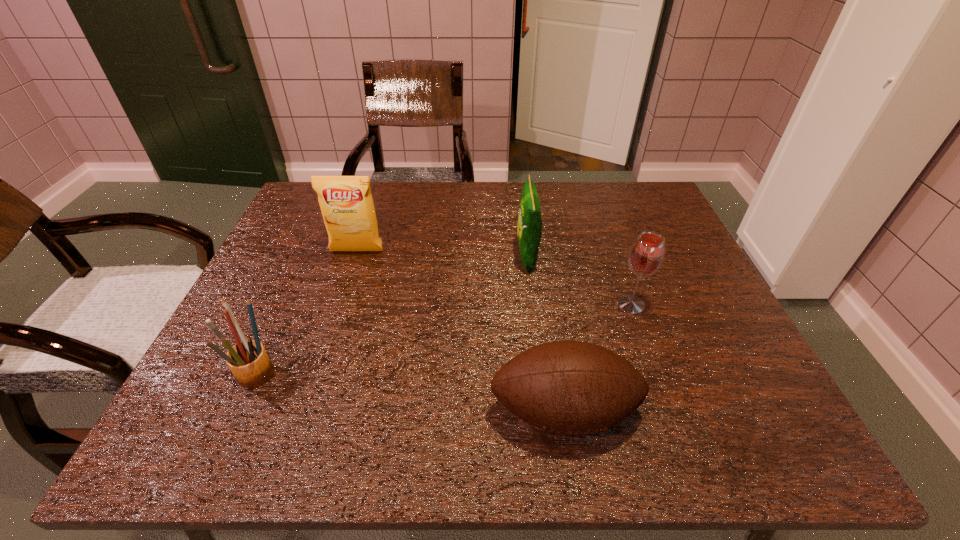
What are the coordinates of `vacant space situated on the left of the rightmost object` in the screenshot? It's located at (517, 305).

Image resolution: width=960 pixels, height=540 pixels. I want to click on free spot located on the back of the pencil box, so click(x=317, y=243).

At what (x,y) coordinates should I click in order to perform the action: click on object that is at the near edge. Please return your answer as a coordinate pair (x, y). Image resolution: width=960 pixels, height=540 pixels. Looking at the image, I should click on coord(569,388).

Image resolution: width=960 pixels, height=540 pixels. What are the coordinates of `crisp (potato chip) present at the left edge` in the screenshot? It's located at (346, 202).

Where is `pencil box positioned at the left edge`? The height and width of the screenshot is (540, 960). pencil box positioned at the left edge is located at coordinates (248, 361).

This screenshot has height=540, width=960. In the image, there is a desktop. Find the location of `vacant space at the far edge`. vacant space at the far edge is located at coordinates (534, 181).

You are a GUI agent. You are given a task and a screenshot of the screen. Output one action in this format:
    pyautogui.click(x=<x>, y=<y>)
    Task: Click on the vacant space at the near edge of the desktop
    
    Given the screenshot: What is the action you would take?
    pyautogui.click(x=526, y=422)

I want to click on free point at the left edge, so click(x=286, y=273).

Identify the location of vacant space at the right edge of the desktop. The image size is (960, 540). (625, 231).

Locate an element on the screen. The image size is (960, 540). free space at the near left corner of the desktop is located at coordinates (255, 417).